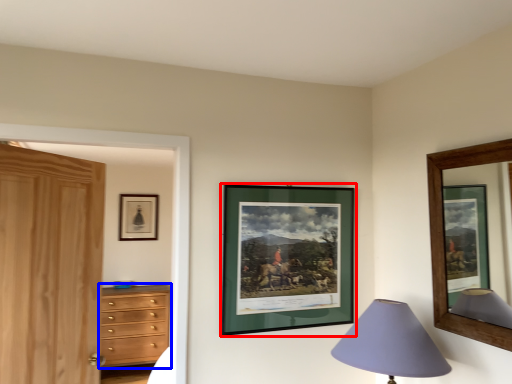
Question: Which point is further to the camera, picture frame (highlighted by a red box) or chest of drawers (highlighted by a blue box)?

Choices:
 (A) picture frame
 (B) chest of drawers

Answer: (B)